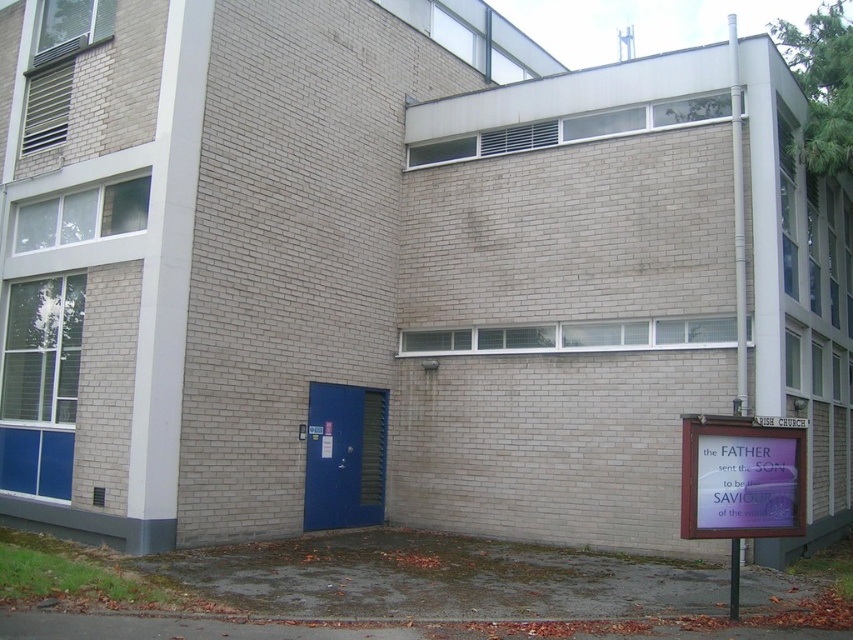
You are a delivery person trying to find the entrance to the building. You see the purple glossy sign at lower right and the blue matte door at center. According to the sign, where is the entrance located?

The entrance is at the blue matte door at center because the purple glossy sign at lower right is positioned over it, indicating the door is the main entrance.